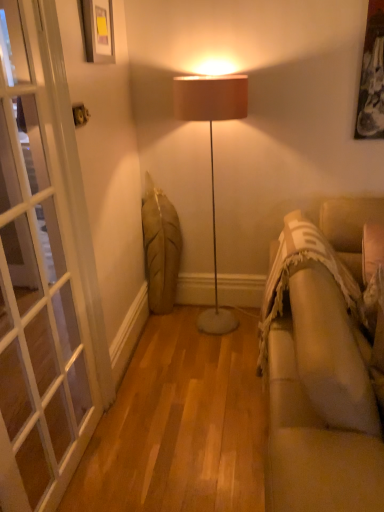
The image size is (384, 512). Identify the location of beige fabric couch at right. (320, 366).

This screenshot has height=512, width=384. I want to click on matte black picture frame at upper left, so click(97, 30).

Looking at this image, can you confirm if white glass screen door at left is positioned to the left of beige fabric couch at right?

Yes, white glass screen door at left is to the left of beige fabric couch at right.

Locate an element on the screen. screen door above the beige fabric couch at right (from the image's perspective) is located at coordinates (38, 272).

Is white glass screen door at left positioned in front of beige fabric couch at right?

No, white glass screen door at left is further to the viewer.

From the picture: Is white glass screen door at left taller than beige fabric couch at right?

Yes, white glass screen door at left is taller than beige fabric couch at right.

Can you confirm if beige fabric couch at right is positioned to the right of matte black picture frame at upper left?

Yes, beige fabric couch at right is to the right of matte black picture frame at upper left.

Looking at this image, could you tell me if beige fabric couch at right is turned towards matte black picture frame at upper left?

No, beige fabric couch at right is not oriented towards matte black picture frame at upper left.

In the scene shown: From the image's perspective, does beige fabric couch at right appear lower than matte black picture frame at upper left?

Yes.

Considering the sizes of objects beige fabric couch at right and matte black picture frame at upper left in the image provided, who is thinner, beige fabric couch at right or matte black picture frame at upper left?

matte black picture frame at upper left is thinner.

Can you tell me how much matte black picture frame at upper left and white glass screen door at left differ in facing direction?

4.32 degrees separate the facing orientations of matte black picture frame at upper left and white glass screen door at left.

Considering the sizes of objects matte black picture frame at upper left and white glass screen door at left in the image provided, who is smaller, matte black picture frame at upper left or white glass screen door at left?

With smaller size is matte black picture frame at upper left.

Identify the location of screen door that is on the left side of matte black picture frame at upper left. The width and height of the screenshot is (384, 512). (38, 272).

Is matte black picture frame at upper left inside the boundaries of white glass screen door at left, or outside?

The correct answer is: outside.

Considering the sizes of matte black picture frame at upper left and beige fabric couch at right in the image, is matte black picture frame at upper left bigger or smaller than beige fabric couch at right?

Clearly, matte black picture frame at upper left is smaller in size than beige fabric couch at right.

From a real-world perspective, which is physically below, matte black picture frame at upper left or beige fabric couch at right?

beige fabric couch at right is physically lower.

Is matte black picture frame at upper left in front of or behind beige fabric couch at right in the image?

Clearly, matte black picture frame at upper left is behind beige fabric couch at right.

Is beige fabric couch at right inside the boundaries of white glass screen door at left, or outside?

beige fabric couch at right is located beyond the bounds of white glass screen door at left.

Is beige fabric couch at right not near white glass screen door at left?

Absolutely, beige fabric couch at right is distant from white glass screen door at left.

Based on their sizes in the image, would you say beige fabric couch at right is bigger or smaller than white glass screen door at left?

Considering their sizes, beige fabric couch at right takes up more space than white glass screen door at left.

Considering the relative positions of beige fabric couch at right and white glass screen door at left in the image provided, is beige fabric couch at right to the right of white glass screen door at left from the viewer's perspective?

Indeed, beige fabric couch at right is positioned on the right side of white glass screen door at left.

Is white glass screen door at left bigger than matte black picture frame at upper left?

Correct, white glass screen door at left is larger in size than matte black picture frame at upper left.

From a real-world perspective, does white glass screen door at left stand above matte black picture frame at upper left?

Actually, white glass screen door at left is physically below matte black picture frame at upper left in the real world.

How many degrees apart are the facing directions of white glass screen door at left and matte black picture frame at upper left?

4.32 degrees separate the facing orientations of white glass screen door at left and matte black picture frame at upper left.

Does point (92, 395) lie behind point (97, 55)?

Yes.

Identify the location of screen door behind the beige fabric couch at right. pyautogui.click(x=38, y=272).

The width and height of the screenshot is (384, 512). In order to click on studio couch that appears on the right of matte black picture frame at upper left in this screenshot , I will do `click(320, 366)`.

In the scene shown: When comparing their distances from beige fabric couch at right, does matte black picture frame at upper left or white glass screen door at left seem closer?

white glass screen door at left lies closer to beige fabric couch at right than the other object.

Considering their positions, is beige fabric couch at right positioned closer to matte black picture frame at upper left than white glass screen door at left?

white glass screen door at left is positioned closer to the anchor matte black picture frame at upper left.

Considering their positions, is white glass screen door at left positioned closer to beige fabric couch at right than matte black picture frame at upper left?

white glass screen door at left is closer to beige fabric couch at right.

From the image, which object appears to be farther from matte black picture frame at upper left, white glass screen door at left or beige fabric couch at right?

The object further to matte black picture frame at upper left is beige fabric couch at right.

Estimate the real-world distances between objects in this image. Which object is closer to white glass screen door at left, matte black picture frame at upper left or beige fabric couch at right?

The object closer to white glass screen door at left is matte black picture frame at upper left.

Estimate the real-world distances between objects in this image. Which object is further from white glass screen door at left, beige fabric couch at right or matte black picture frame at upper left?

The object further to white glass screen door at left is beige fabric couch at right.

Identify the location of screen door between matte black picture frame at upper left and beige fabric couch at right vertically. (38, 272).